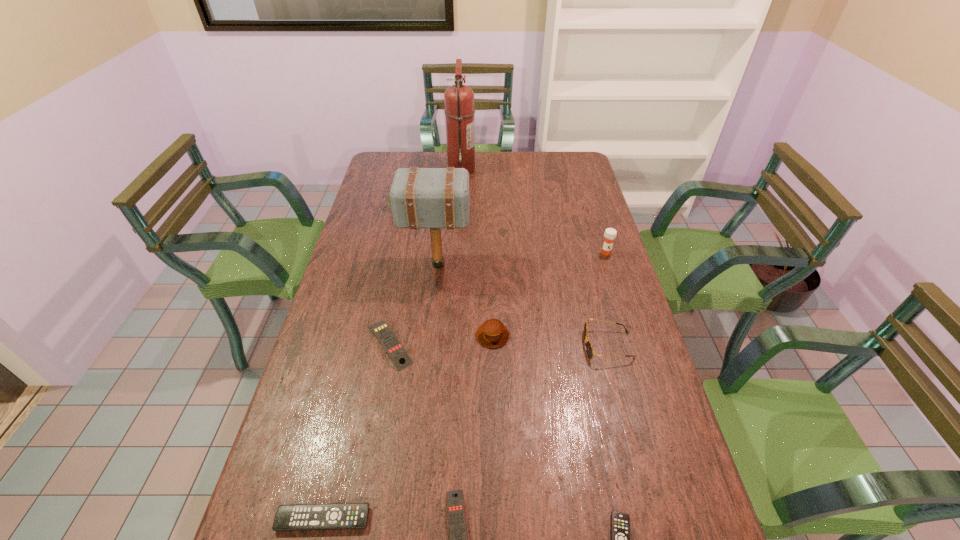
The height and width of the screenshot is (540, 960). Find the location of `blank space located 0.050m on the lenses of the black sunglasses`. blank space located 0.050m on the lenses of the black sunglasses is located at coordinates (566, 346).

Identify the location of vacant space located on the lenses of the black sunglasses. (545, 346).

Where is `vacant space situated 0.060m on the back of the tallest remote control`? This screenshot has height=540, width=960. vacant space situated 0.060m on the back of the tallest remote control is located at coordinates pos(396,305).

Identify the location of blank area located 0.200m on the back of the bigger black remote control. (347, 419).

Identify the location of object situated at the far edge. (459, 111).

I want to click on avocado that is at the left edge, so click(389, 197).

Image resolution: width=960 pixels, height=540 pixels. I want to click on medicine situated at the right edge, so click(x=610, y=234).

At what (x,y) coordinates should I click in order to perform the action: click on sunglasses that is at the right edge. Please return your answer as a coordinate pair (x, y). Image resolution: width=960 pixels, height=540 pixels. Looking at the image, I should click on (589, 348).

Where is `vacant space at the far edge of the desktop`? This screenshot has height=540, width=960. vacant space at the far edge of the desktop is located at coordinates (423, 152).

Find the location of a particular element. This screenshot has width=960, height=540. vacant region at the left edge is located at coordinates (307, 437).